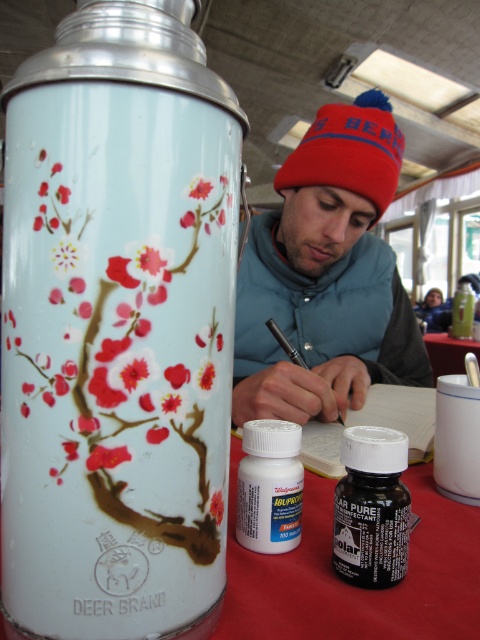
You are organizing a picnic and have both the matte blue beanie at center and the black matte bottle at lower center on the table. If you want to place them side by side in your bag, which one should you place first to ensure they fit properly?

The matte blue beanie at center should be placed first because it is positioned on the right side of the black matte bottle at lower center, indicating it might be larger or require more space.

You are a photographer setting up a shot of the scene. You need to position a light source so it illuminates the white plastic bottle at center and the smooth white table at center. Since both objects are white, how can you adjust the lighting to distinguish them?

Since the white plastic bottle at center is located below the smooth white table at center, you can position the light source above the table to cast a shadow of the bottle onto the table. This shadow will help differentiate the two white objects by creating a contrast between the illuminated table surface and the shadowed area beneath it.